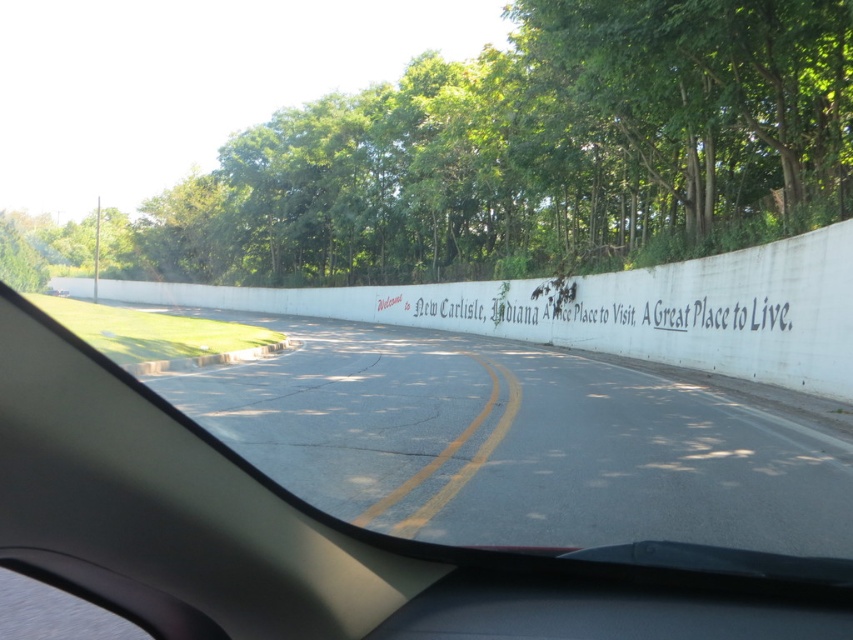
You are a passenger in the car and notice the green leafy trees at upper center and the white concrete wall at center. Which object is positioned to the left of the other?

The green leafy trees at upper center are to the left of the white concrete wall at center.

You are driving a car and looking out the windshield. You see a white concrete wall at center and white painted text at center. Which object is closer to you?

The white concrete wall at center is closer to you because it is positioned under the white painted text at center, meaning the wall is in front of the text.

You are a driver approaching New Carlisle, Indiana. You notice the green leafy trees at upper center and the white concrete wall at center. Which object appears wider in the scene?

The green leafy trees at upper center are wider than the white concrete wall at center.